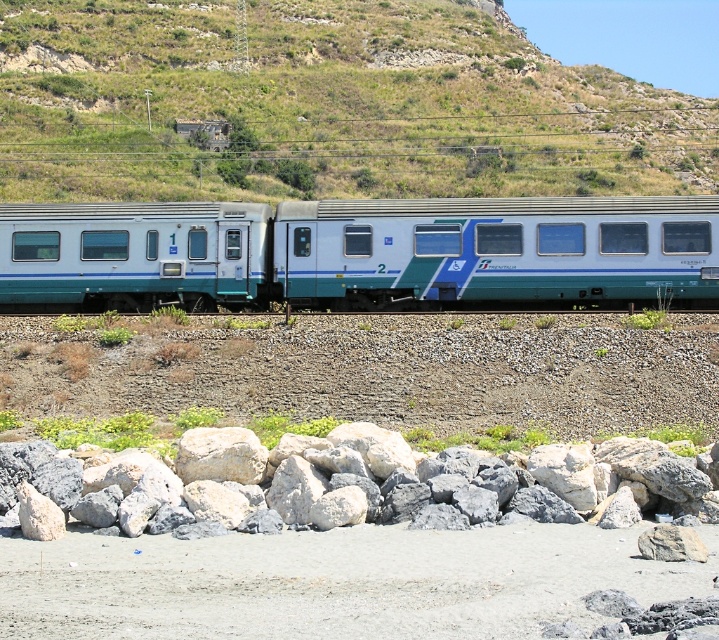
Question: Can you confirm if gray rock at lower left is positioned below matte blue train car at left?

Choices:
 (A) yes
 (B) no

Answer: (A)

Question: Can you confirm if green grassy hillside at upper center is wider than gray rock at lower left?

Choices:
 (A) no
 (B) yes

Answer: (B)

Question: Which point is farther to the camera?

Choices:
 (A) white glossy train car at center
 (B) gray rock at lower left
 (C) green grassy hillside at upper center
 (D) matte blue train car at left

Answer: (C)

Question: Which point is closer to the camera taking this photo?

Choices:
 (A) (47, 280)
 (B) (544, 106)

Answer: (A)

Question: Is white glossy train car at center behind gray rock at lower left?

Choices:
 (A) no
 (B) yes

Answer: (B)

Question: Based on their relative distances, which object is farther from the green grassy hillside at upper center?

Choices:
 (A) white glossy train car at center
 (B) matte blue train car at left

Answer: (B)